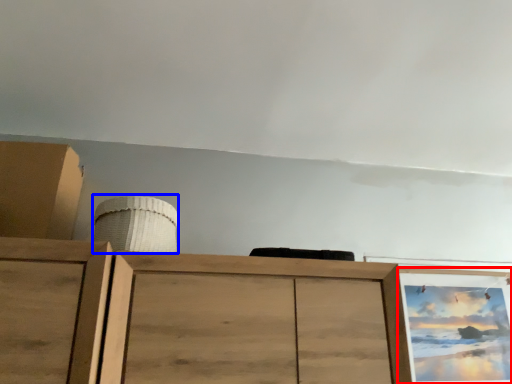
Question: Among these objects, which one is farthest to the camera, picture frame (highlighted by a red box) or job (highlighted by a blue box)?

Choices:
 (A) picture frame
 (B) job

Answer: (A)